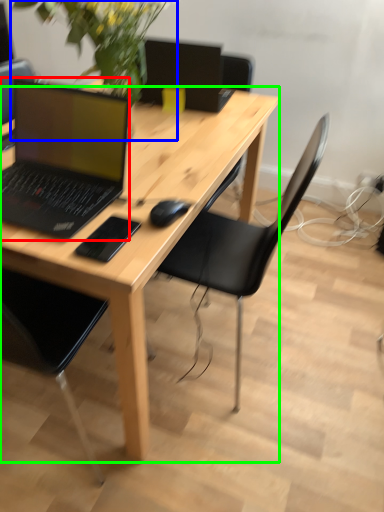
Question: Which object is positioned closest to laptop (highlighted by a red box)? Select from floral arrangement (highlighted by a blue box) and desk (highlighted by a green box).

Choices:
 (A) floral arrangement
 (B) desk

Answer: (B)